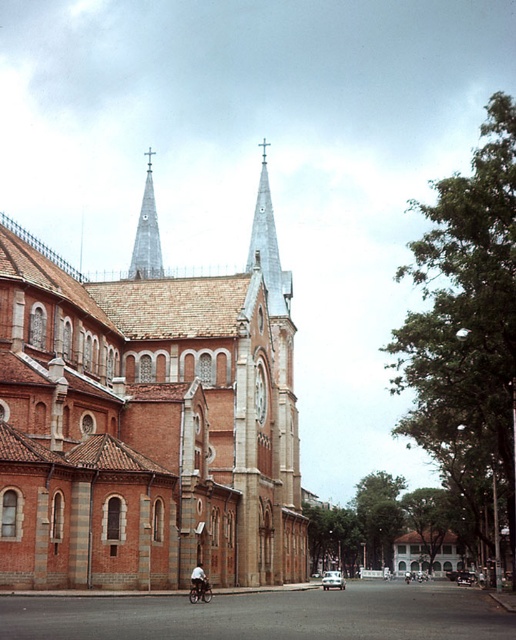
Question: Among these objects, which one is farthest from the camera?

Choices:
 (A) dark blue fabric shirt at lower center
 (B) brick textured church at center

Answer: (A)

Question: Is shiny silver spire at upper center bigger than dark blue fabric shirt at lower center?

Choices:
 (A) yes
 (B) no

Answer: (A)

Question: Which point is closer to the camera?

Choices:
 (A) (196, 589)
 (B) (291, 284)
 (C) (157, 248)

Answer: (A)

Question: Can you confirm if brick textured church at center is positioned to the left of shiny silver spire at center?

Choices:
 (A) no
 (B) yes

Answer: (A)

Question: Which point is closer to the camera taking this photo?

Choices:
 (A) (154, 264)
 (B) (206, 580)
 (C) (267, 296)

Answer: (B)

Question: Is brick textured church at center to the right of shiny silver spire at upper center from the viewer's perspective?

Choices:
 (A) no
 (B) yes

Answer: (B)